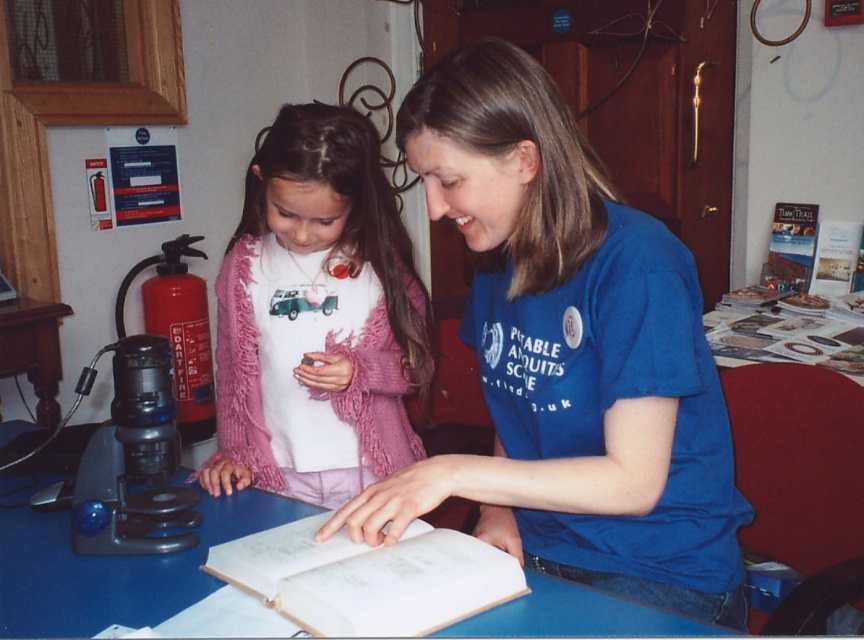
Between blue cotton shirt at center and pink fringed sweater at center, which one has less height?

pink fringed sweater at center is shorter.

Who is more forward, (594, 484) or (307, 147)?

Point (594, 484) is in front.

You are a GUI agent. You are given a task and a screenshot of the screen. Output one action in this format:
    pyautogui.click(x=<x>, y=<y>)
    Task: Click on the blue cotton shirt at center
    
    Given the screenshot: What is the action you would take?
    pyautogui.click(x=569, y=355)

You are a GUI agent. You are given a task and a screenshot of the screen. Output one action in this format:
    pyautogui.click(x=<x>, y=<y>)
    Task: Click on the blue cotton shirt at center
    
    Given the screenshot: What is the action you would take?
    pyautogui.click(x=569, y=355)

Which is in front, point (729, 534) or point (187, 560)?

Positioned in front is point (729, 534).

The image size is (864, 640). Find the location of `blue cotton shirt at center`. blue cotton shirt at center is located at coordinates (569, 355).

Can you confirm if blue cotton shirt at center is taller than white paper book at center?

Yes.

Looking at this image, between blue cotton shirt at center and white paper book at center, which one appears on the left side from the viewer's perspective?

white paper book at center

Is point (502, 166) positioned before point (306, 592)?

No, (502, 166) is behind (306, 592).

I want to click on blue cotton shirt at center, so click(x=569, y=355).